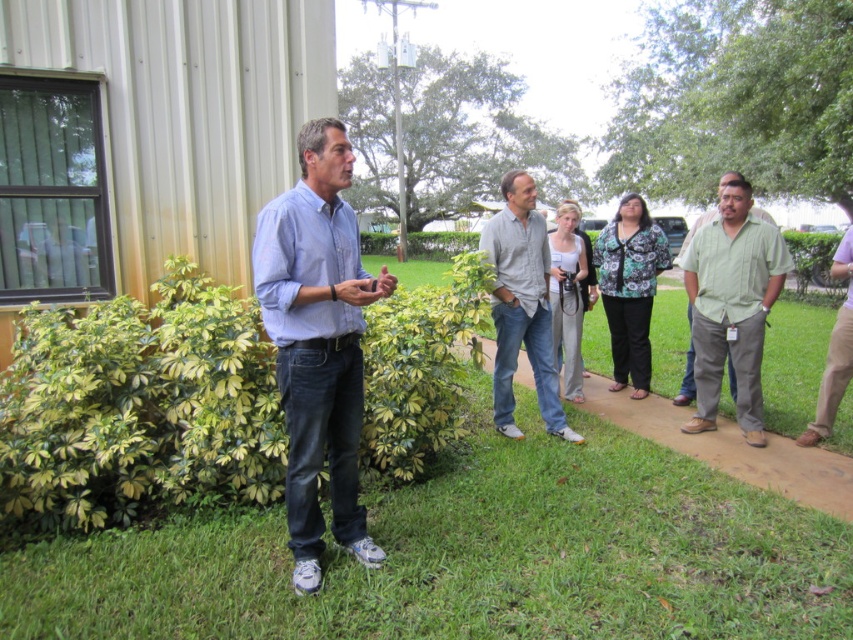
You are a photographer trying to capture a candid shot of the denim jeans at center without including the green grass at center in the frame. Based on their positions, is this possible?

The green grass at center is to the right of denim jeans at center, so if you position yourself to the left side of the denim jeans at center, you can avoid including the green grass at center in your shot.

You are a photographer trying to capture a candid shot of the denim jeans at center without including the green grass at center in the background. Based on their positions, is this possible?

The green grass at center is below denim jeans at center, so if you position the camera to focus on the denim jeans at center and ensure the frame excludes the lower area where the green grass at center is located, it should be possible to capture the denim jeans without the grass in the background.

You are standing at point (325,324) and want to walk to point (74,627). Which direction should you move in?

You should move forward because point (74,627) is in front of point (325,324).